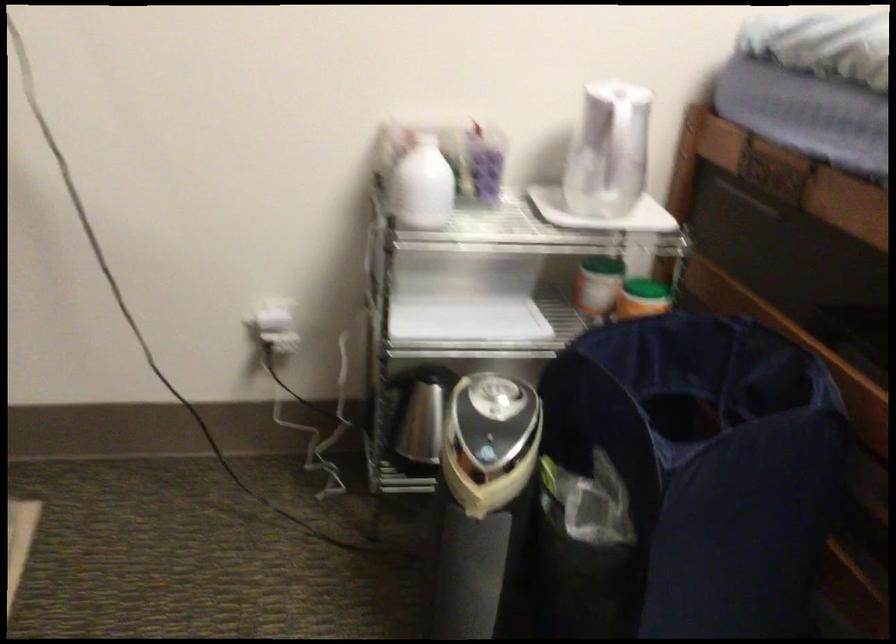
What do you see at coordinates (486, 453) in the screenshot? Image resolution: width=896 pixels, height=644 pixels. I see `a appliance button` at bounding box center [486, 453].